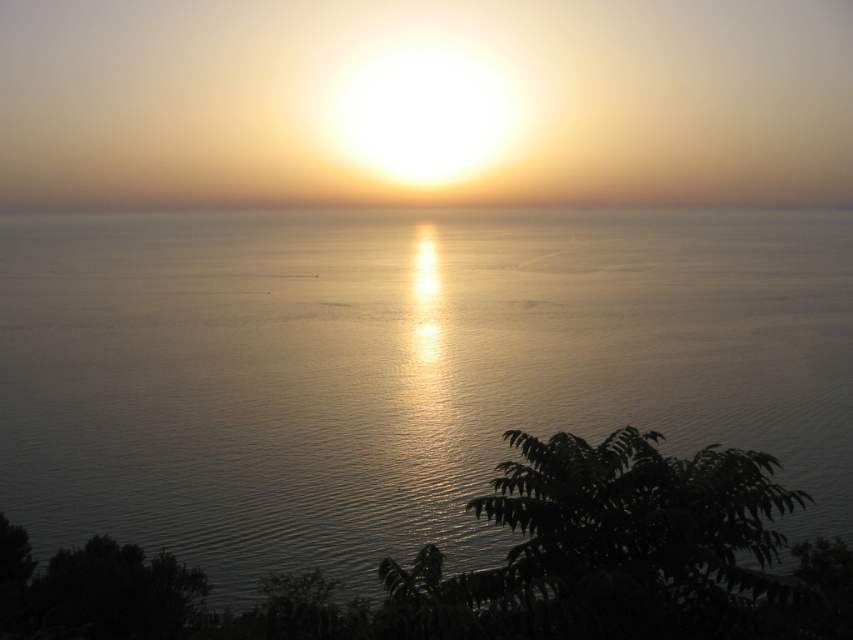
Question: Does silvery reflective water at center have a greater width compared to smooth sand horizon at center?

Choices:
 (A) yes
 (B) no

Answer: (B)

Question: Which point is closer to the camera?

Choices:
 (A) (601, 198)
 (B) (279, 342)

Answer: (B)

Question: Which of the following is the farthest from the observer?

Choices:
 (A) smooth sand horizon at center
 (B) silvery reflective water at center

Answer: (A)

Question: Where is silvery reflective water at center located in relation to smooth sand horizon at center in the image?

Choices:
 (A) above
 (B) below

Answer: (B)

Question: Can you confirm if silvery reflective water at center is positioned above smooth sand horizon at center?

Choices:
 (A) yes
 (B) no

Answer: (B)